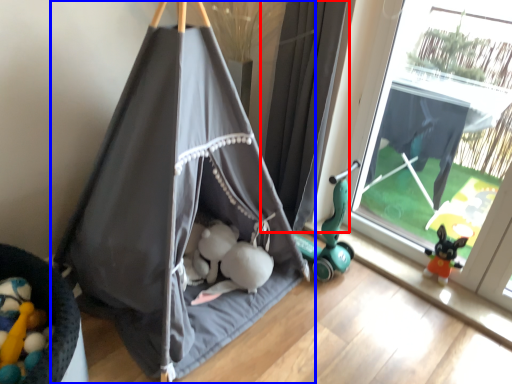
Question: Among these objects, which one is nearest to the camera, curtain (highlighted by a red box) or tent (highlighted by a blue box)?

Choices:
 (A) curtain
 (B) tent

Answer: (B)